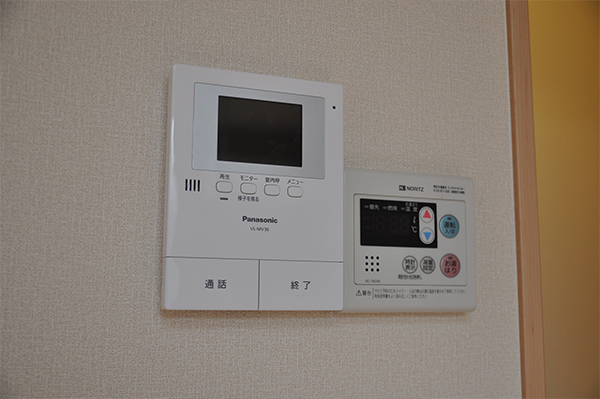
Identify the location of indicator light. (333, 107).